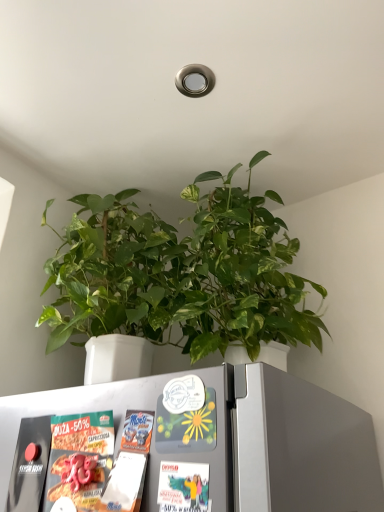
Question: Is white matte refrigerator at lower center at the back of green matte plant at center?

Choices:
 (A) no
 (B) yes

Answer: (A)

Question: Considering the relative sizes of green matte plant at center and white matte refrigerator at lower center in the image provided, is green matte plant at center shorter than white matte refrigerator at lower center?

Choices:
 (A) no
 (B) yes

Answer: (A)

Question: Can we say green matte plant at center lies outside white matte refrigerator at lower center?

Choices:
 (A) yes
 (B) no

Answer: (A)

Question: From the image's perspective, does green matte plant at center appear lower than white matte refrigerator at lower center?

Choices:
 (A) yes
 (B) no

Answer: (B)

Question: Can you confirm if green matte plant at center is bigger than white matte refrigerator at lower center?

Choices:
 (A) yes
 (B) no

Answer: (A)

Question: Is white matte refrigerator at lower center completely or partially inside green matte plant at center?

Choices:
 (A) yes
 (B) no

Answer: (B)

Question: Is white matte refrigerator at lower center shorter than green matte plant at center?

Choices:
 (A) no
 (B) yes

Answer: (B)

Question: From the image's perspective, is white matte refrigerator at lower center below green matte plant at center?

Choices:
 (A) no
 (B) yes

Answer: (B)

Question: Is white matte refrigerator at lower center outside of green matte plant at center?

Choices:
 (A) yes
 (B) no

Answer: (A)

Question: From a real-world perspective, is white matte refrigerator at lower center physically above green matte plant at center?

Choices:
 (A) no
 (B) yes

Answer: (A)

Question: From a real-world perspective, is white matte refrigerator at lower center physically below green matte plant at center?

Choices:
 (A) no
 (B) yes

Answer: (B)

Question: Considering the relative positions of white matte refrigerator at lower center and green matte plant at center in the image provided, is white matte refrigerator at lower center to the left of green matte plant at center from the viewer's perspective?

Choices:
 (A) yes
 (B) no

Answer: (A)

Question: Based on their sizes in the image, would you say green matte plant at center is bigger or smaller than white matte refrigerator at lower center?

Choices:
 (A) big
 (B) small

Answer: (A)